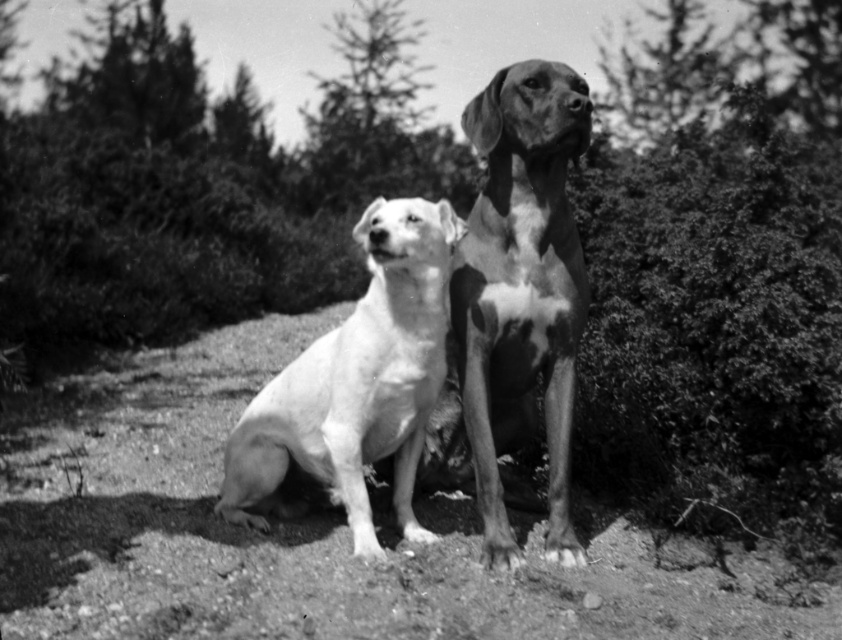
Who is higher up, spotted fur dog at center or white smooth dog at center?

spotted fur dog at center

Image resolution: width=842 pixels, height=640 pixels. What do you see at coordinates (521, 289) in the screenshot?
I see `spotted fur dog at center` at bounding box center [521, 289].

Who is more distant from viewer, (561, 458) or (388, 452)?

Positioned behind is point (388, 452).

The image size is (842, 640). I want to click on spotted fur dog at center, so coord(521,289).